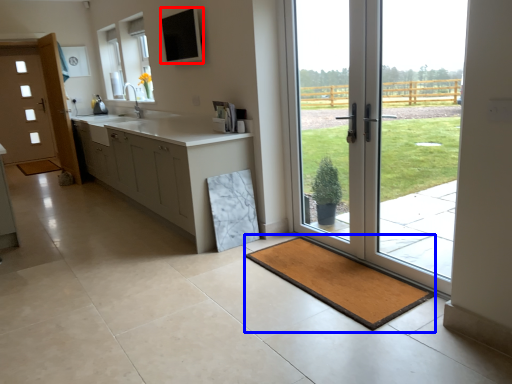
Question: Which object appears closest to the camera in this image, window screen (highlighted by a red box) or bath mat (highlighted by a blue box)?

Choices:
 (A) window screen
 (B) bath mat

Answer: (B)